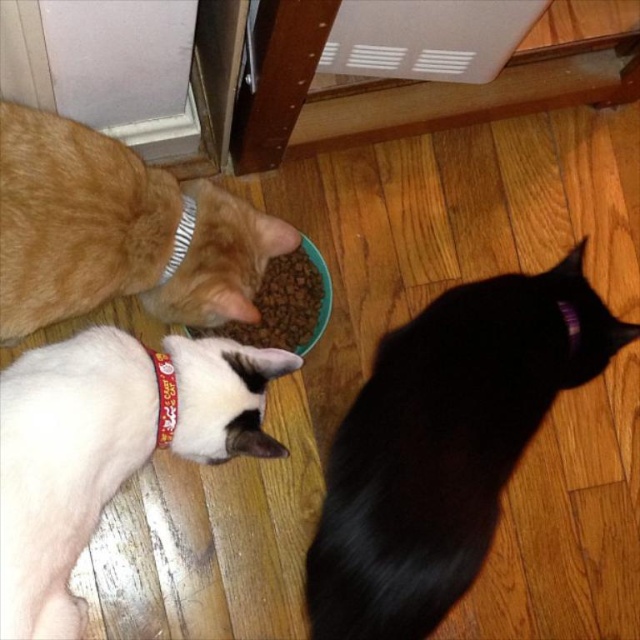
You are a cat owner who wants to ensure all cats get enough food. The white fur cat at lower left and dry kibble at center are present. Which object is bigger and needs more space?

The white fur cat at lower left is larger in size than the dry kibble at center, so it needs more space.

You are a cat owner who wants to ensure all your cats have enough space to eat comfortably. Given that the black silky cat at lower right and the orange fur cat at left are both near the food bowl, which cat is positioned to the right of the other?

The black silky cat at lower right is positioned on the right side of orange fur cat at left.

You are a cat owner who wants to ensure your cats are safe while eating. You notice the black silky cat at lower right and the dry kibble at center in the image. Which cat is closer to the food, and could this arrangement potentially lead to a food competition between them?

The black silky cat at lower right is in front of the dry kibble at center, meaning it is closer to the food. This arrangement could potentially lead to food competition since the cat is positioned directly in front of the food, possibly preventing others from accessing it easily.